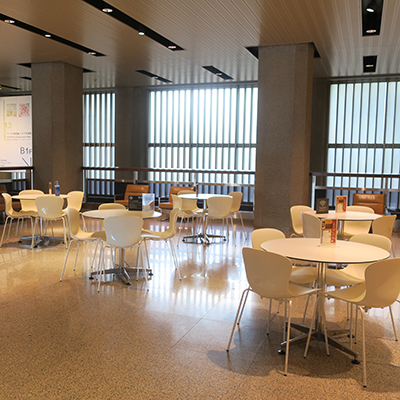
Locate an element on the screen. The width and height of the screenshot is (400, 400). table is located at coordinates (346, 253), (360, 217), (204, 197), (101, 216), (26, 197).